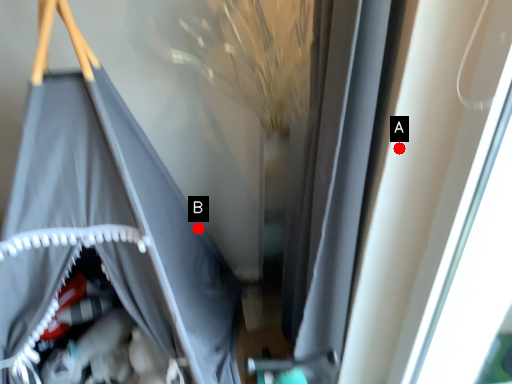
Question: Two points are circled on the image, labeled by A and B beside each circle. Among these points, which one is nearest to the camera?

Choices:
 (A) A is closer
 (B) B is closer

Answer: (A)